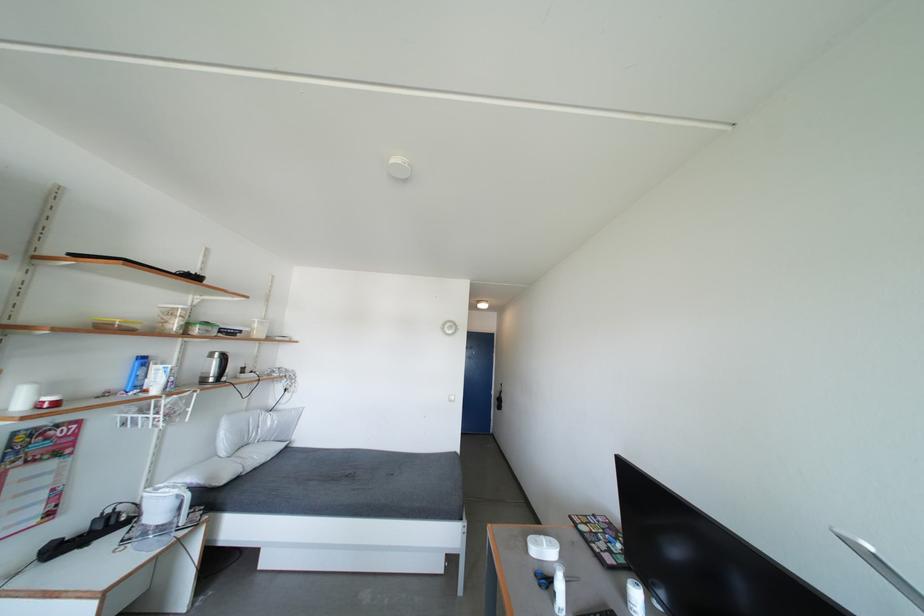
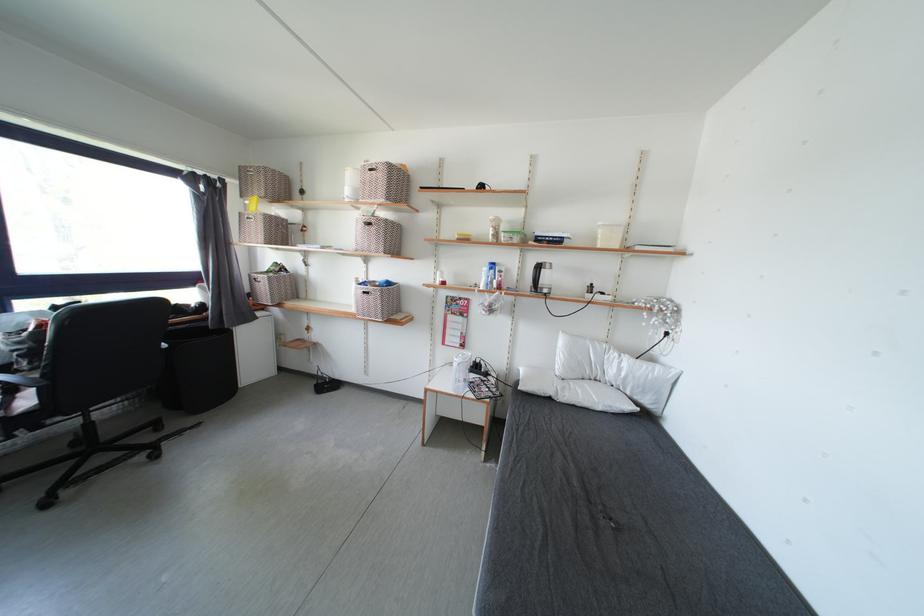
The point at (228, 439) is marked in the first image. Where is the corresponding point in the second image?

(565, 355)